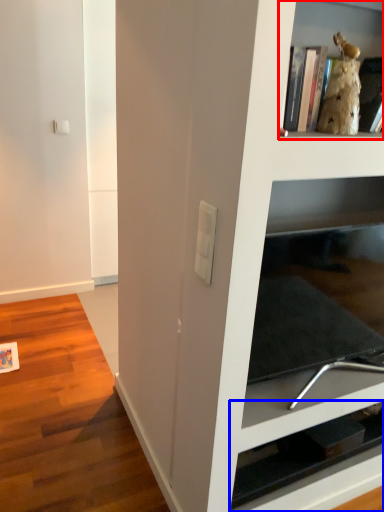
Question: Which object is further to the camera taking this photo, shelf (highlighted by a red box) or shelf (highlighted by a blue box)?

Choices:
 (A) shelf
 (B) shelf

Answer: (B)